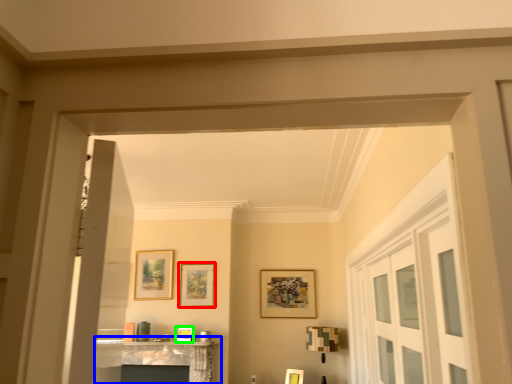
Question: Which object is the closest to the picture frame (highlighted by a red box)? Choose among these: table (highlighted by a blue box) or picture frame (highlighted by a green box).

Choices:
 (A) table
 (B) picture frame

Answer: (B)